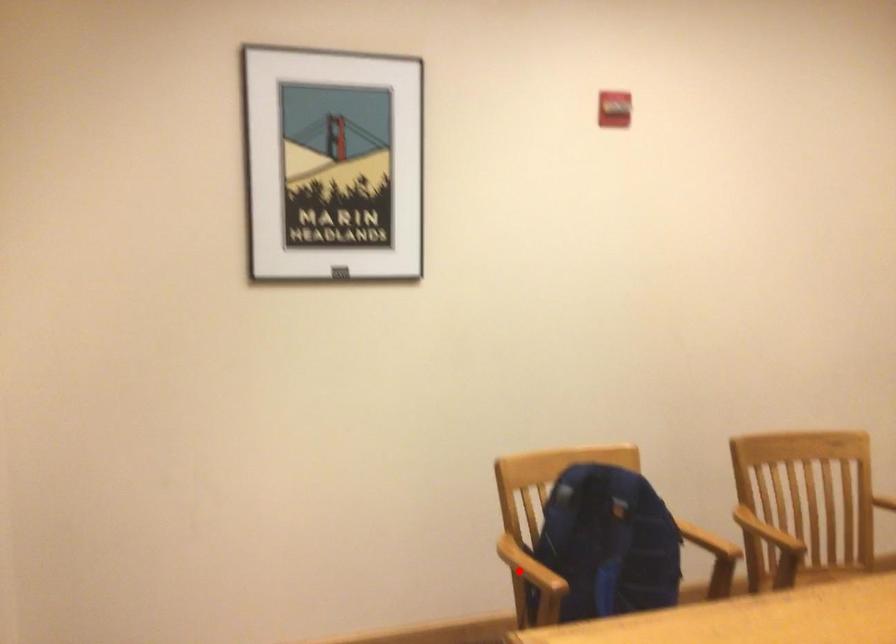
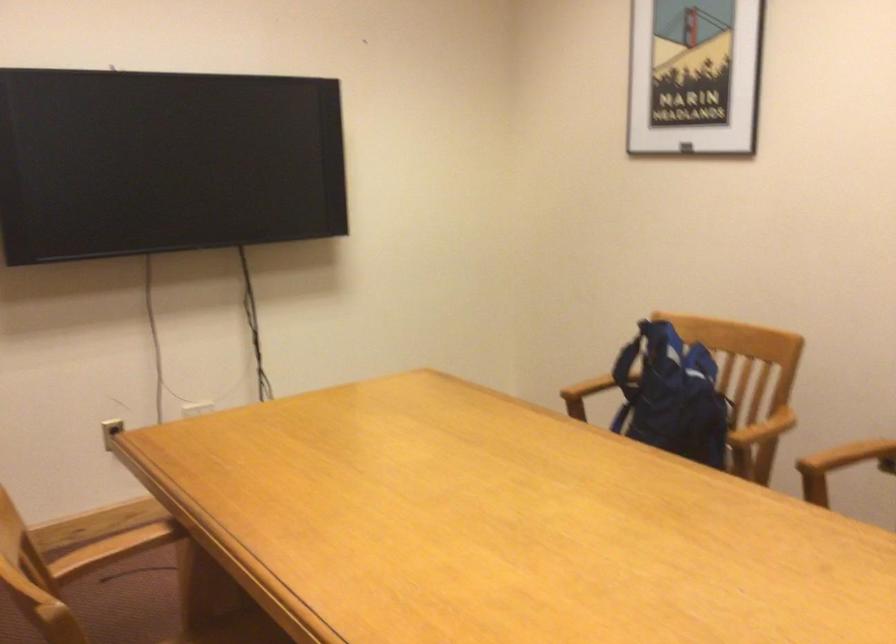
Where in the second image is the point corresponding to the highlighted location from the first image?

(586, 388)